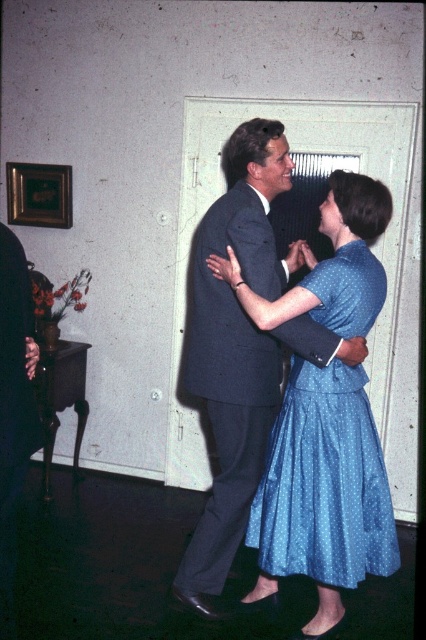
You are a photographer setting up for a dance photoshoot in a room with a closed door and two dancers. You need to position your camera so that both the blue dotted dress at center and the blue dotted fabric dress at center are in frame. Which dress should you place on the left side of the frame to ensure proper alignment?

The blue dotted dress at center should be placed on the left side of the frame because it is positioned on the left side of the blue dotted fabric dress at center in the scene.